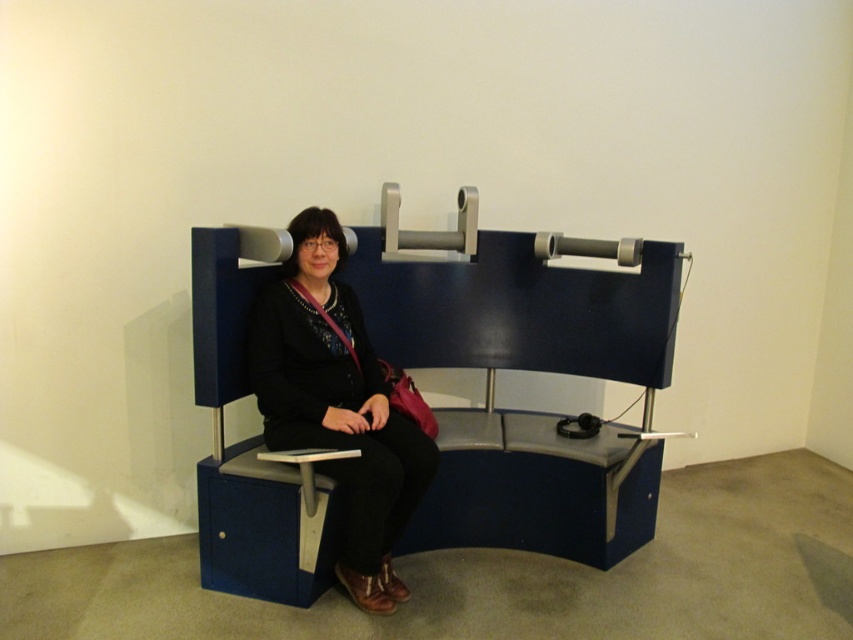
Can you confirm if blue plastic bench at center is positioned to the left of matte black jacket at center?

Incorrect, blue plastic bench at center is not on the left side of matte black jacket at center.

Between point (612, 531) and point (338, 234), which one is positioned in front?

Point (338, 234) is more forward.

At what (x,y) coordinates should I click in order to perform the action: click on blue plastic bench at center. Please return your answer as a coordinate pair (x, y). The width and height of the screenshot is (853, 640). Looking at the image, I should click on (525, 369).